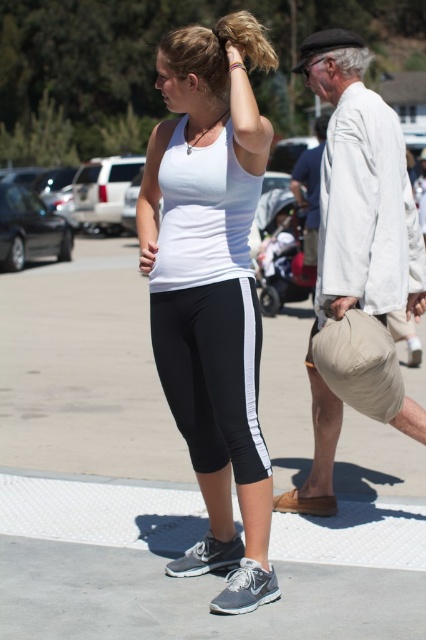
You are standing at the point marked by coordinates point (224, 392) in the image. You want to walk to the nearest person. Which direction should you go?

The point (224, 392) is 14.59 feet away from the viewer. To reach the nearest person, you should walk towards the viewer since they are closer than the individuals in the scene.

You are standing at the point marked as point (x=158, y=163) in the image. If you want to walk towards the woman in the white sleeveless top and black capri leggings, will you have to move forward or backward?

Since the distance of point (x=158, y=163) from the viewer is 15.69 feet, moving forward from this point would bring you closer to the woman in the white sleeveless top and black capri leggings.